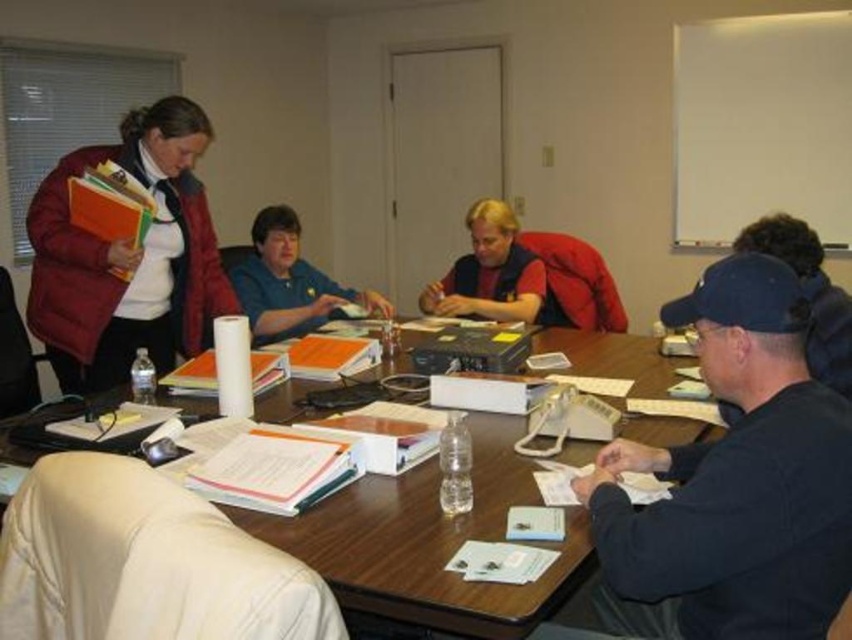
Question: Does wooden table at center appear under matte red jacket at left?

Choices:
 (A) no
 (B) yes

Answer: (B)

Question: Which point appears closest to the camera in this image?

Choices:
 (A) (159, 348)
 (B) (825, 348)
 (C) (432, 298)

Answer: (B)

Question: Which point is closer to the camera?

Choices:
 (A) (582, 444)
 (B) (275, 307)
 (C) (751, 566)

Answer: (C)

Question: Observing the image, what is the correct spatial positioning of wooden table at center in reference to blue fabric shirt at center?

Choices:
 (A) left
 (B) right

Answer: (B)

Question: Estimate the real-world distances between objects in this image. Which object is closer to the matte red jacket at left?

Choices:
 (A) blue fabric shirt at center
 (B) wooden table at center
 (C) matte red shirt at center
 (D) white leather chair at lower left

Answer: (A)

Question: Is wooden table at center smaller than black cap at upper right?

Choices:
 (A) yes
 (B) no

Answer: (B)